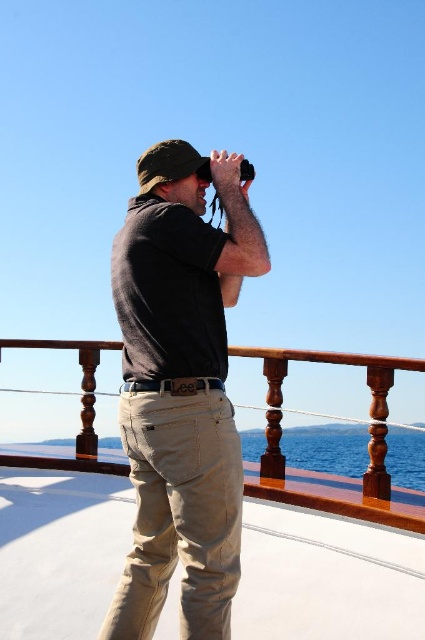
You are a photographer on the boat deck. You need to capture a photo of the wooden railing with the man in the background. According to the scene, where should you position the dark gray cotton shirt at center relative to the wooden at center to include both in the frame?

The dark gray cotton shirt at center is located above wooden at center, so to include both in the frame, position the dark gray cotton shirt at center above the wooden at center in the photo.